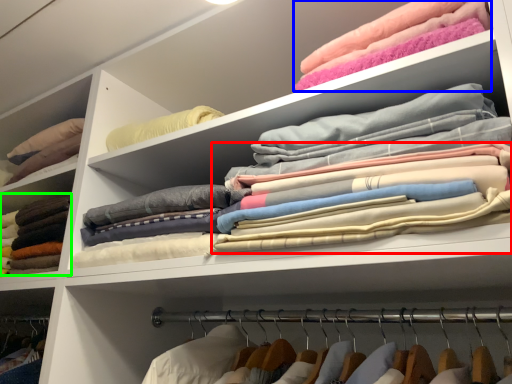
Question: Which object is positioned farthest from clothing (highlighted by a red box)? Select from clothing (highlighted by a blue box) and clothing (highlighted by a green box).

Choices:
 (A) clothing
 (B) clothing

Answer: (B)